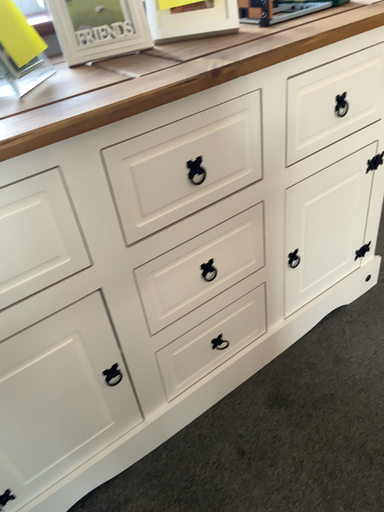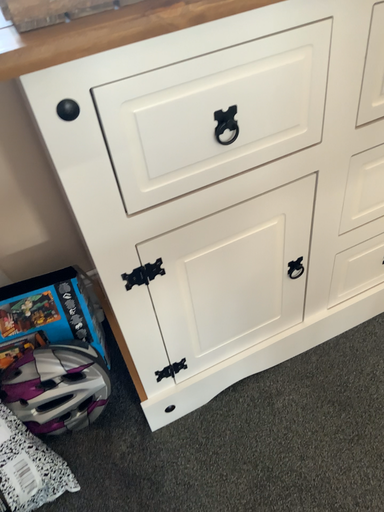
Question: Which way did the camera rotate in the video?

Choices:
 (A) rotated left
 (B) rotated right

Answer: (A)